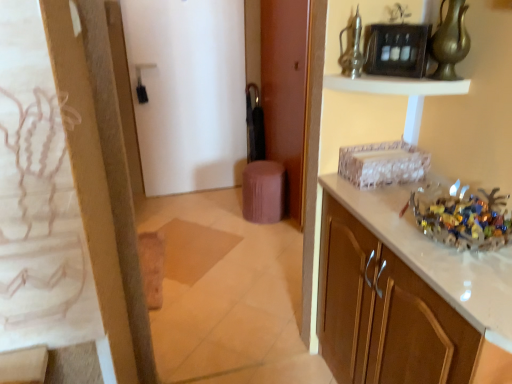
Question: From the image's perspective, is metallic glass vase at upper center, the 2th glass vase from the right, above white glossy shelf at upper center?

Choices:
 (A) yes
 (B) no

Answer: (A)

Question: Is metallic glass vase at upper center, which appears as the first glass vase when viewed from the left, outside white glossy shelf at upper center?

Choices:
 (A) no
 (B) yes

Answer: (B)

Question: From a real-world perspective, is metallic glass vase at upper center, the 2th glass vase from the right, positioned over white glossy shelf at upper center based on gravity?

Choices:
 (A) yes
 (B) no

Answer: (A)

Question: Is white glossy shelf at upper center at the back of metallic glass vase at upper center, the 2th glass vase from the right?

Choices:
 (A) no
 (B) yes

Answer: (A)

Question: Is metallic glass vase at upper center, the 2th glass vase from the right, at the right side of white glossy shelf at upper center?

Choices:
 (A) yes
 (B) no

Answer: (B)

Question: Would you say white glossy cabinet at right is to the left or to the right of translucent glass bowl at right in the picture?

Choices:
 (A) left
 (B) right

Answer: (A)

Question: From the image's perspective, is white glossy cabinet at right located above or below translucent glass bowl at right?

Choices:
 (A) below
 (B) above

Answer: (A)

Question: Choose the correct answer: Is white glossy cabinet at right inside translucent glass bowl at right or outside it?

Choices:
 (A) inside
 (B) outside

Answer: (B)

Question: Does point (416, 274) appear closer or farther from the camera than point (459, 210)?

Choices:
 (A) closer
 (B) farther

Answer: (A)

Question: From the image's perspective, is gold metallic vase at upper right, the 1th glass vase viewed from the right, located above or below brown matte door at center, the second door positioned from the left?

Choices:
 (A) above
 (B) below

Answer: (B)

Question: Looking at the image, does gold metallic vase at upper right, acting as the 2th glass vase starting from the left, seem bigger or smaller compared to brown matte door at center, the second door positioned from the left?

Choices:
 (A) big
 (B) small

Answer: (B)

Question: Does point (459, 57) appear closer or farther from the camera than point (268, 84)?

Choices:
 (A) farther
 (B) closer

Answer: (B)

Question: Choose the correct answer: Is gold metallic vase at upper right, the 1th glass vase viewed from the right, inside brown matte door at center, the second door positioned from the left, or outside it?

Choices:
 (A) outside
 (B) inside

Answer: (A)

Question: Would you say white glossy cabinet at right is to the left or to the right of white matte door at center, the 1th door viewed from the left, in the picture?

Choices:
 (A) left
 (B) right

Answer: (B)

Question: From the image's perspective, is white glossy cabinet at right positioned above or below white matte door at center, the 2th door viewed from the right?

Choices:
 (A) below
 (B) above

Answer: (A)